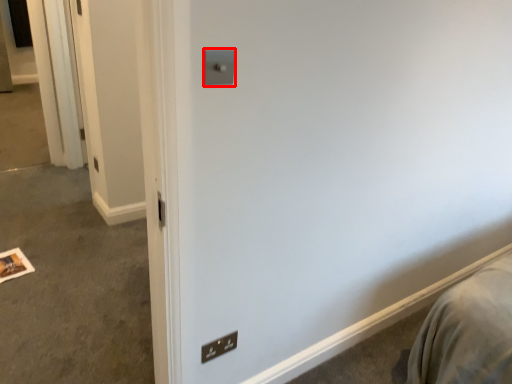
Question: From the image's perspective, considering the relative positions of light switch (annotated by the red box) and light switch in the image provided, where is light switch (annotated by the red box) located with respect to the staircase?

Choices:
 (A) above
 (B) below

Answer: (A)